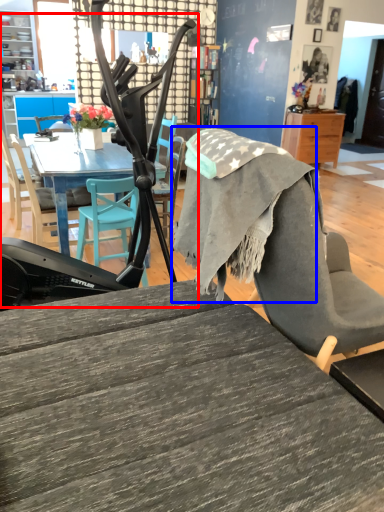
Question: Which point is closer to the camera, baby carriage (highlighted by a red box) or fabric (highlighted by a blue box)?

Choices:
 (A) baby carriage
 (B) fabric

Answer: (B)